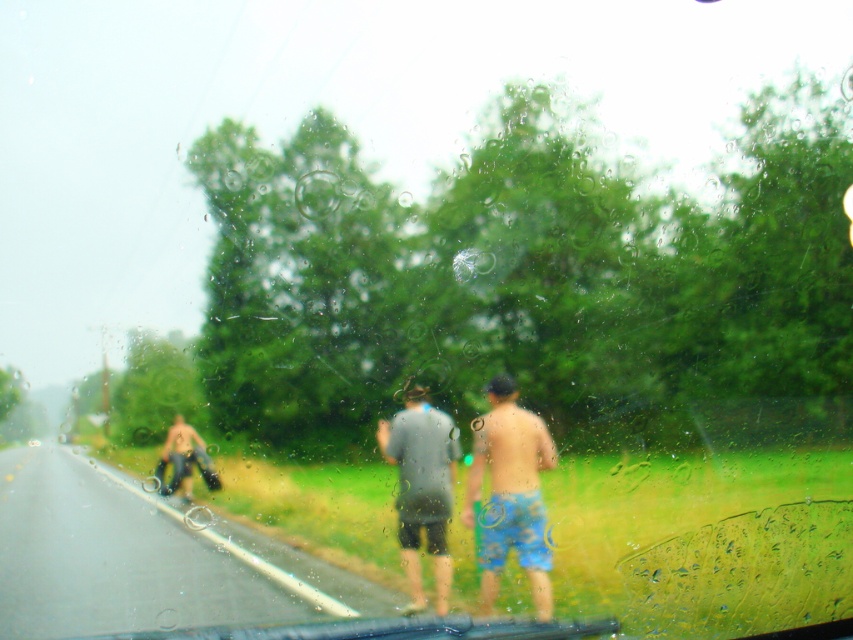
Between point (425, 401) and point (173, 451), which one is positioned behind?

Point (425, 401)

Can you confirm if gray matte shirt at center is wider than denim jeans at left?

Incorrect, gray matte shirt at center's width does not surpass denim jeans at left's.

Which is behind, point (431, 458) or point (180, 422)?

The point (180, 422) is more distant.

This screenshot has width=853, height=640. I want to click on gray matte shirt at center, so click(422, 488).

Is point (486, 516) positioned after point (192, 432)?

That is False.

Does blue printed shorts at right appear over denim jeans at left?

Yes.

Identify the location of blue printed shorts at right. (509, 493).

Identify the location of blue printed shorts at right. (509, 493).

Between blue printed shorts at right and gray matte shirt at center, which one appears on the left side from the viewer's perspective?

Positioned to the left is gray matte shirt at center.

Between blue printed shorts at right and gray matte shirt at center, which one has less height?

gray matte shirt at center

This screenshot has height=640, width=853. In order to click on blue printed shorts at right in this screenshot , I will do `click(509, 493)`.